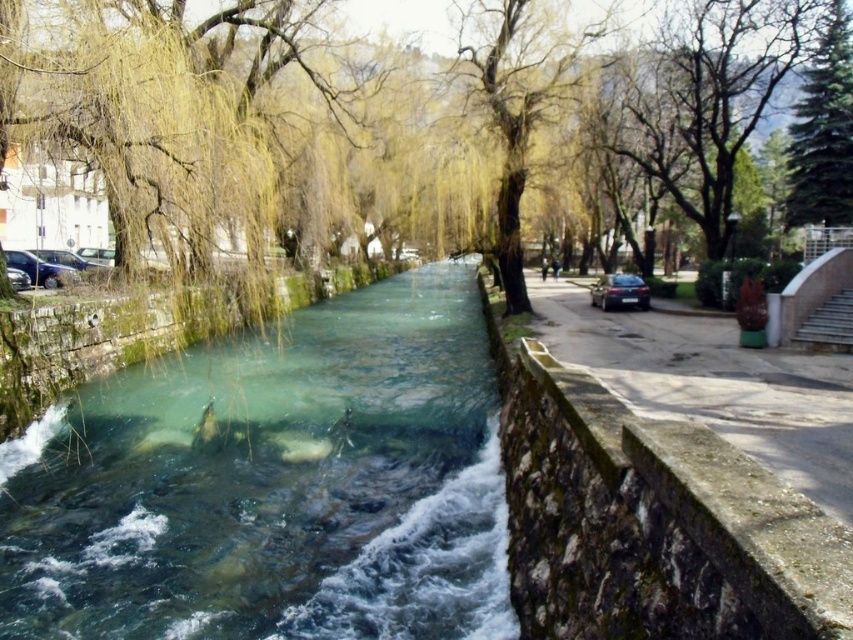
You are a pedestrian standing on the pathway near the satin black car at right. You want to cross to the other side of the clear stone stream at center. Which direction should you walk to reach the stream first?

You should walk to the left because the clear stone stream at center is located to the left of the satin black car at right, so moving left will bring you closer to the stream first.

You are standing at the center of the image and want to walk to the satin black car at right. Which direction should you head to reach it?

The satin black car at right is located at point 0.456 on the x and 0.727 on the y, so you should head towards the right and slightly upwards to reach it.